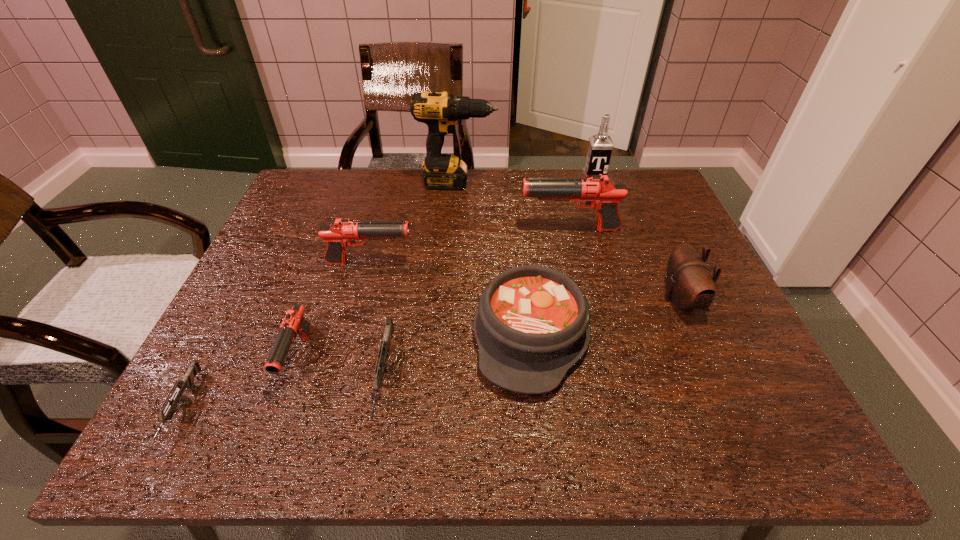
Where is `vacant area that lies between the casserole and the second tallest object`? The height and width of the screenshot is (540, 960). vacant area that lies between the casserole and the second tallest object is located at coordinates (563, 255).

Identify the location of free point between the black drill and the second nearest black gun. The image size is (960, 540). (414, 223).

At what (x,y) coordinates should I click in order to perform the action: click on free space between the left grey gun and the fourth tallest gun. Please return your answer as a coordinate pair (x, y). The image size is (960, 540). Looking at the image, I should click on (283, 393).

This screenshot has width=960, height=540. Identify the location of vacant space that's between the smaller grey gun and the tallest gun. (376, 319).

This screenshot has width=960, height=540. I want to click on empty space between the casserole and the nearest black gun, so tap(415, 346).

I want to click on free space between the eighth shortest object and the third tallest object, so click(x=582, y=202).

Locate an element on the screen. Image resolution: width=960 pixels, height=540 pixels. free spot between the rightmost object and the biggest black gun is located at coordinates [x=625, y=265].

The image size is (960, 540). In order to click on the fourth closest object relative to the nearest black gun in this screenshot , I will do `click(532, 326)`.

The width and height of the screenshot is (960, 540). Identify the location of the eighth closest object relative to the gray casserole. (187, 382).

Locate an element on the screen. This screenshot has height=540, width=960. gun that is the third nearest to the brown pouch is located at coordinates (381, 368).